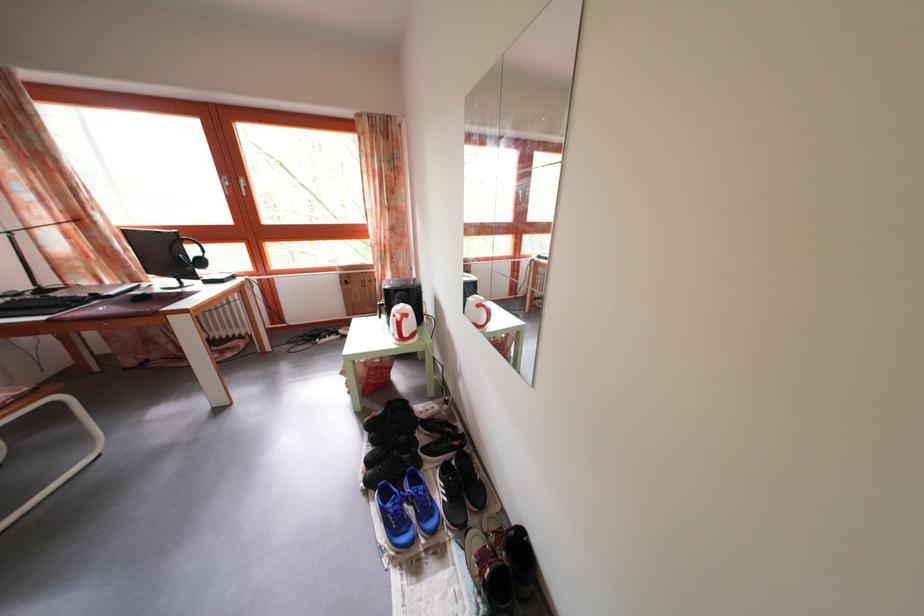
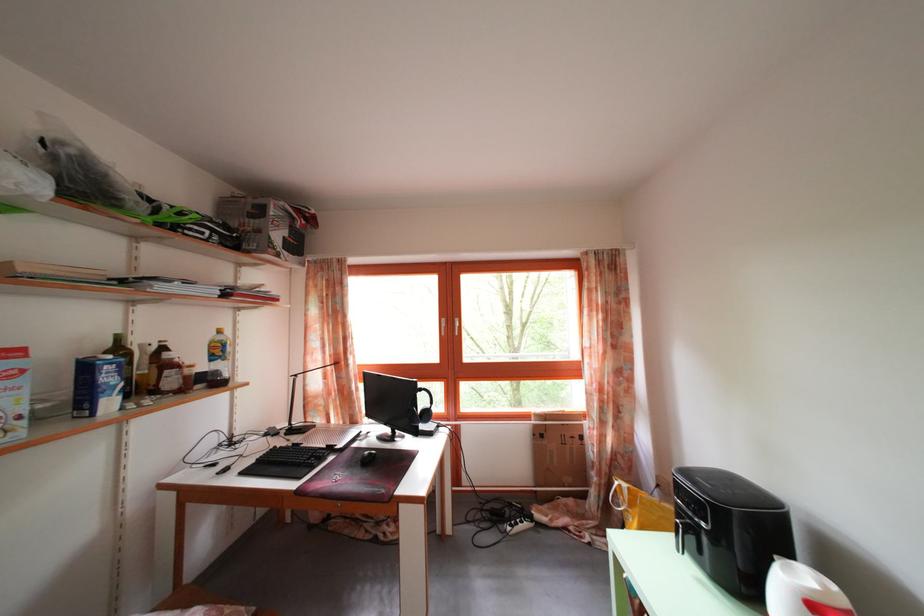
Question: I am providing you with two images of the same scene from different viewpoints. After the viewpoint changes to image2, which objects are now occluded?

Choices:
 (A) silver window handle
 (B) white electric kettle
 (C) air fryer handle
 (D) none of these

Answer: (D)